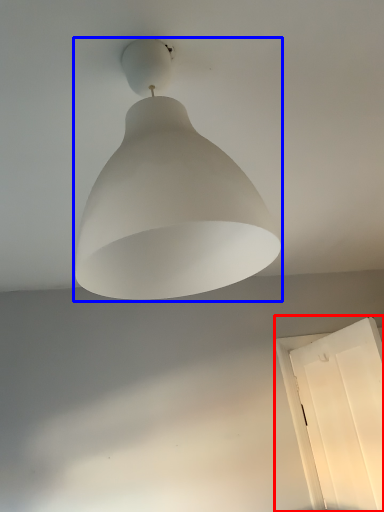
Question: Which object appears closest to the camera in this image, window (highlighted by a red box) or lamp (highlighted by a blue box)?

Choices:
 (A) window
 (B) lamp

Answer: (B)